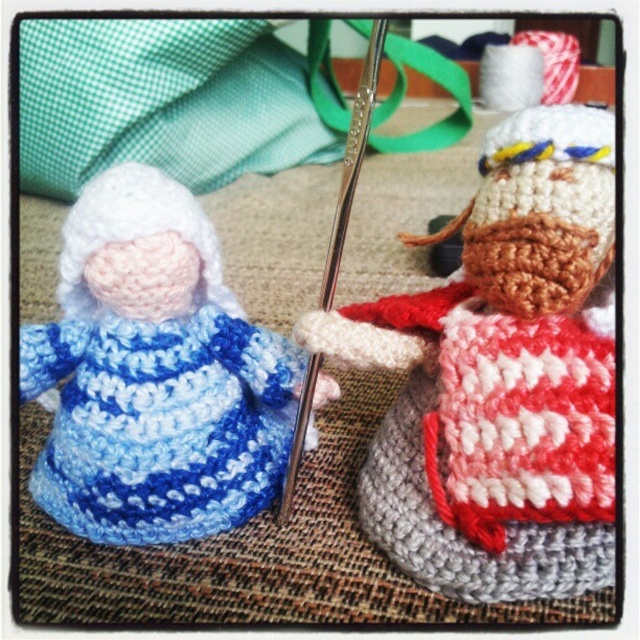
Question: Is red and white knitted sweater at center to the right of blue yarn doll at left from the viewer's perspective?

Choices:
 (A) no
 (B) yes

Answer: (B)

Question: Among these objects, which one is nearest to the camera?

Choices:
 (A) red and white knitted sweater at center
 (B) blue yarn doll at left

Answer: (A)

Question: Can you confirm if red and white knitted sweater at center is positioned below blue yarn doll at left?

Choices:
 (A) yes
 (B) no

Answer: (A)

Question: Which point is farther to the camera?

Choices:
 (A) (445, 484)
 (B) (108, 384)

Answer: (B)

Question: Does red and white knitted sweater at center have a larger size compared to blue yarn doll at left?

Choices:
 (A) yes
 (B) no

Answer: (B)